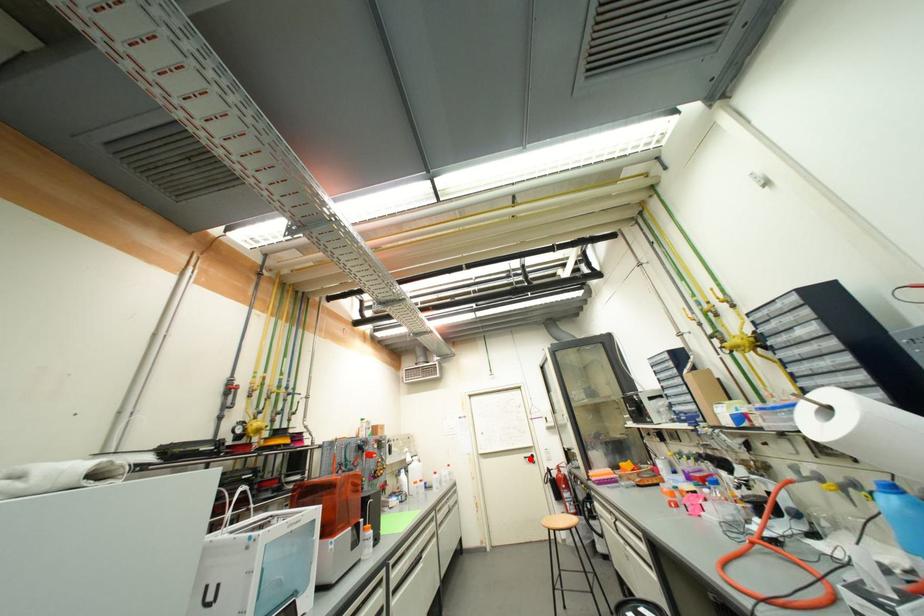
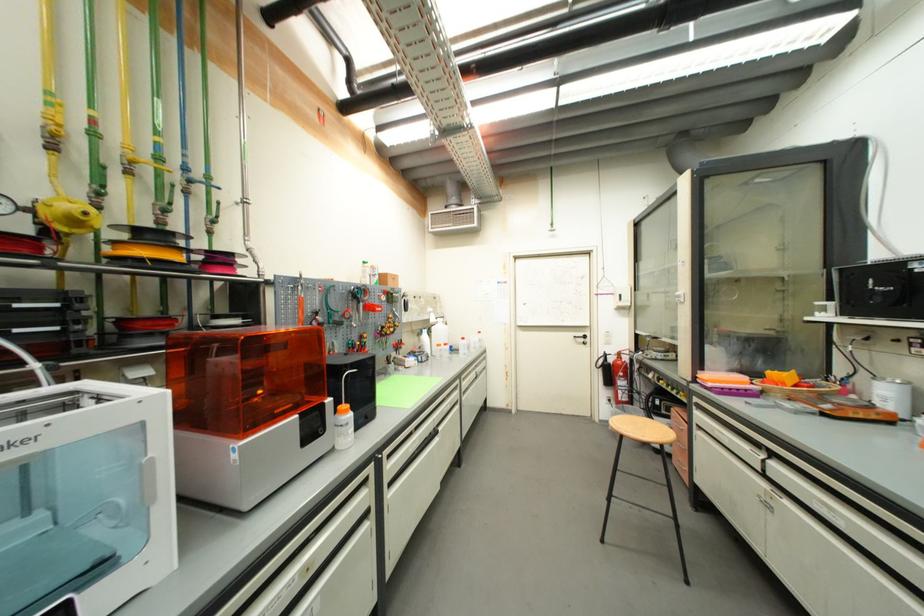
Locate, in the second image, the point that corresponds to the highlighted location in the first image.

(580, 339)